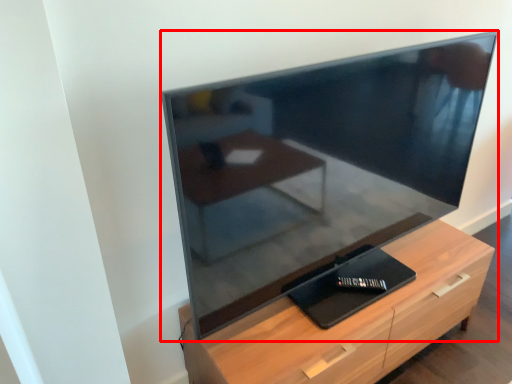
Question: From the image's perspective, what is the correct spatial positioning of television (annotated by the red box) in reference to chest of drawers?

Choices:
 (A) above
 (B) below

Answer: (A)